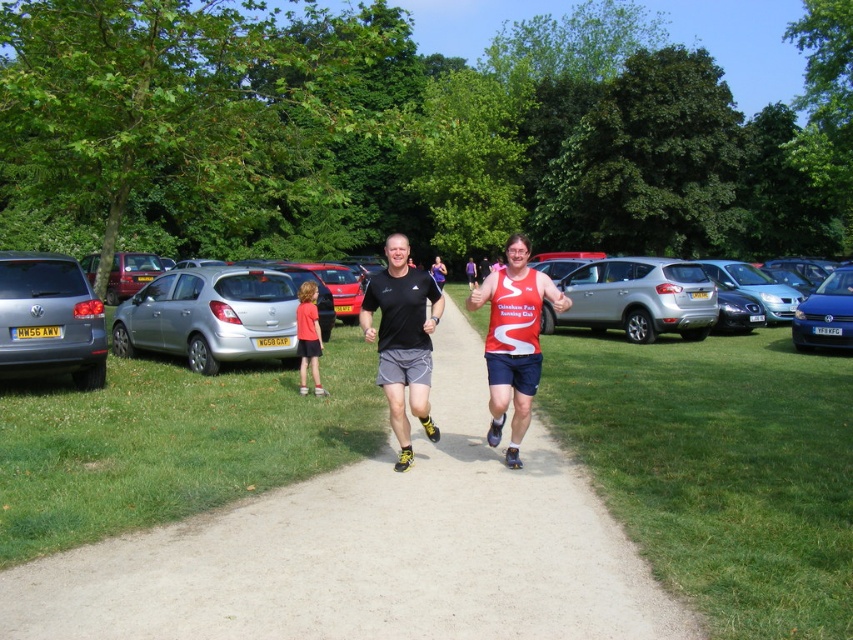
Consider the image. You are standing at the starting point of the path and want to take a photo of the red matte running shirt at center without the matte silver car at left blocking the view. Is this possible?

The matte silver car at left is further to the viewer than the red matte running shirt at center, so the car is closer to you. To avoid blocking the view of the red matte running shirt at center, you can move to the side or adjust your angle so that the car is not in front of the shirt.

You are a runner preparing to cross the path between the matte silver car at left and the red matte running shirt at center. Which object is closer to your starting position?

The matte silver car at left is closer to your starting position because it is positioned on the left side of the red matte running shirt at center, meaning it is nearer to where you are standing.

In the scene shown: You are a photographer standing at the starting point of the running path. You need to capture a photo that includes both the matte silver car at left and the red matte running shirt at center. Which object should you position closer to the bottom of the frame to ensure both are visible?

To include both the matte silver car at left and the red matte running shirt at center in the photo, position the red matte running shirt at center closer to the bottom of the frame since the matte silver car at left is above it.